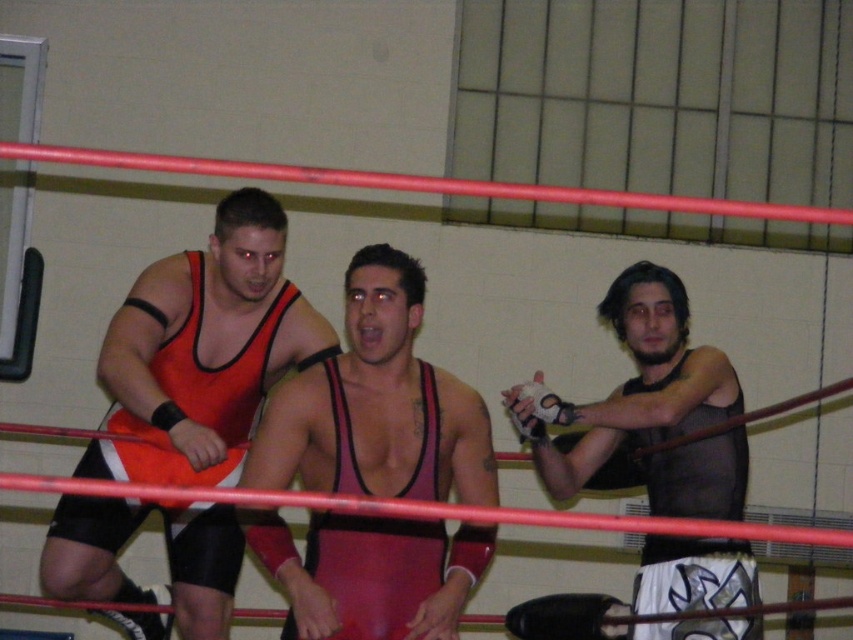
Is point (213, 572) farther from viewer compared to point (467, 572)?

Yes, point (213, 572) is behind point (467, 572).

Which is more to the left, matte orange singlet at center or shiny red singlet at center?

From the viewer's perspective, matte orange singlet at center appears more on the left side.

Which is behind, point (123, 422) or point (318, 531)?

The point (123, 422) is more distant.

At what (x,y) coordinates should I click in order to perform the action: click on matte orange singlet at center. Please return your answer as a coordinate pair (x, y). Looking at the image, I should click on (202, 349).

Who is positioned more to the right, shiny red singlet at center or black mesh tank top at right?

black mesh tank top at right is more to the right.

Is shiny red singlet at center to the left of black mesh tank top at right from the viewer's perspective?

Yes, shiny red singlet at center is to the left of black mesh tank top at right.

Between point (415, 484) and point (637, 376), which one is positioned behind?

The point (637, 376) is behind.

The width and height of the screenshot is (853, 640). In order to click on shiny red singlet at center in this screenshot , I will do `click(376, 404)`.

Which is more to the left, matte orange singlet at center or black mesh tank top at right?

matte orange singlet at center is more to the left.

Identify the location of matte orange singlet at center. This screenshot has height=640, width=853. (202, 349).

The image size is (853, 640). I want to click on matte orange singlet at center, so click(202, 349).